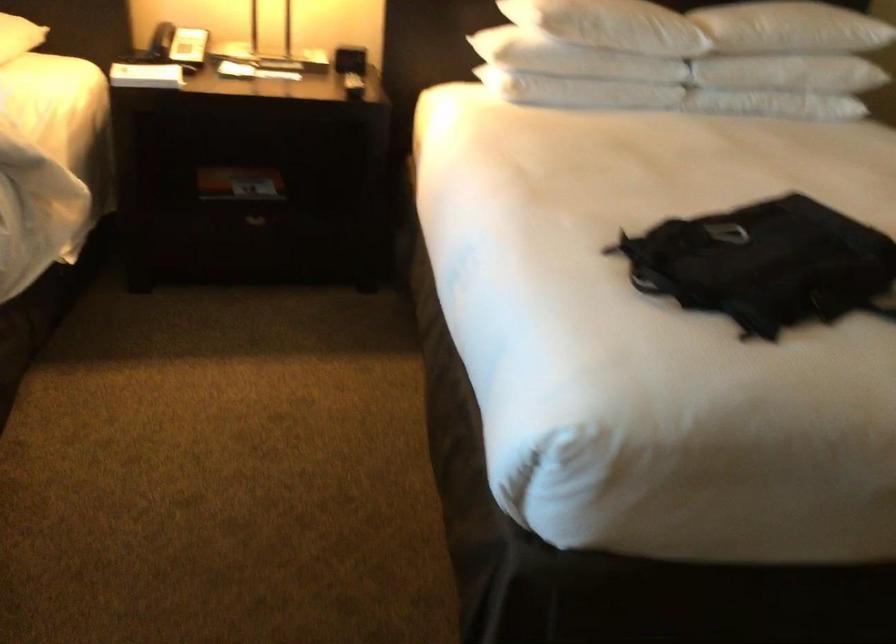
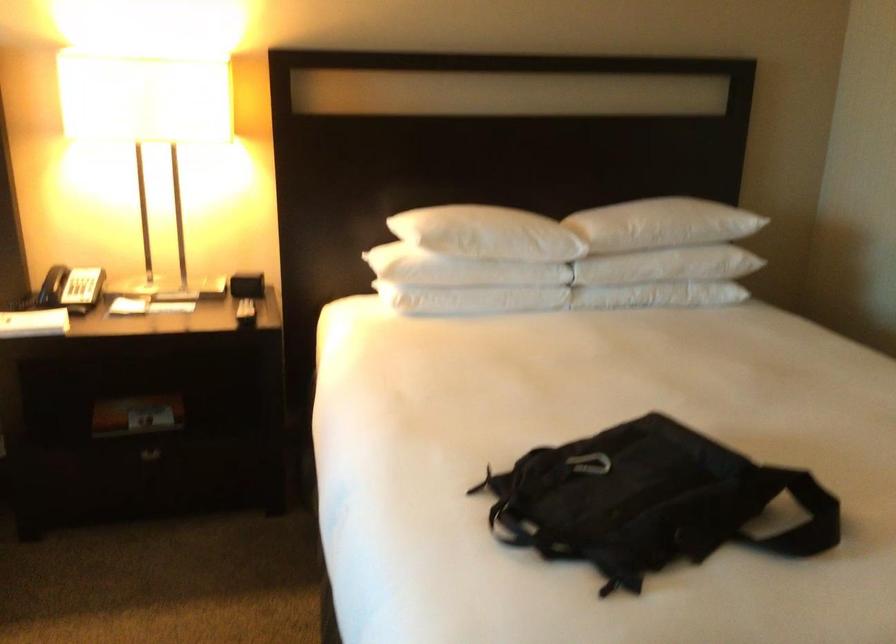
In the second image, find the point that corresponds to (x=784, y=261) in the first image.

(649, 502)